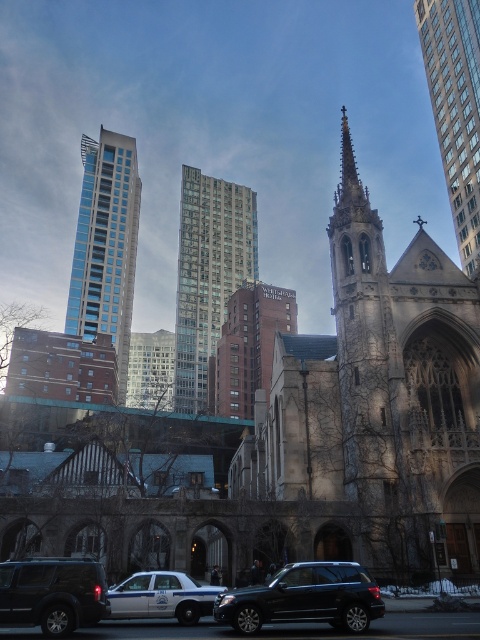
Does glassy concrete building at center lie behind glassy steel skyscraper at center?

That is True.

Can you confirm if glassy concrete building at center is taller than glassy steel skyscraper at center?

No, glassy concrete building at center is not taller than glassy steel skyscraper at center.

Measure the distance between glassy concrete building at center and camera.

glassy concrete building at center and camera are 496.85 feet apart from each other.

Image resolution: width=480 pixels, height=640 pixels. What are the coordinates of `glassy concrete building at center` in the screenshot? It's located at (208, 275).

Between point (108, 296) and point (295, 566), which one is positioned in front?

Point (295, 566) is in front.

Does glassy steel skyscraper at center appear on the left side of shiny black suv at center?

Yes, glassy steel skyscraper at center is to the left of shiny black suv at center.

Find the location of a particular element. This screenshot has height=640, width=480. glassy steel skyscraper at center is located at coordinates (106, 246).

Between black matte suv at lower left and white glossy police car at lower center, which one is positioned lower?

Positioned lower is white glossy police car at lower center.

Looking at this image, which is more to the left, black matte suv at lower left or white glossy police car at lower center?

black matte suv at lower left

Who is more distant from viewer, (91,593) or (124,600)?

Positioned behind is point (124,600).

You are a GUI agent. You are given a task and a screenshot of the screen. Output one action in this format:
    pyautogui.click(x=<x>, y=<y>)
    Task: Click on the black matte suv at lower left
    The width and height of the screenshot is (480, 640).
    Given the screenshot: What is the action you would take?
    pyautogui.click(x=52, y=593)